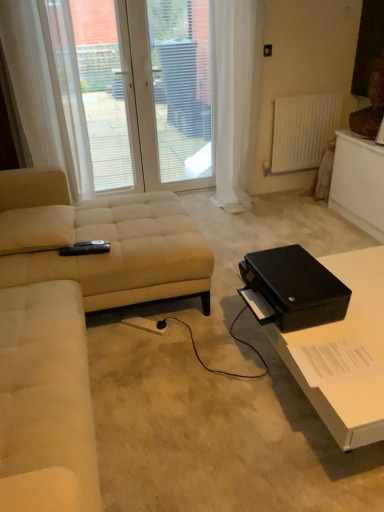
This screenshot has height=512, width=384. I want to click on spots to the right of white fabric curtain at right, the first curtain viewed from the right, so click(285, 205).